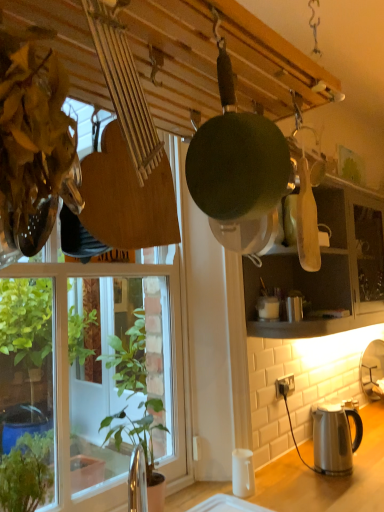
Question: Is green leafy plant at lower left, which appears as the first houseplant when viewed from the left, inside the boundaries of white plastic power outlet at lower right, or outside?

Choices:
 (A) inside
 (B) outside

Answer: (B)

Question: Does point (29, 461) appear closer or farther from the camera than point (291, 376)?

Choices:
 (A) farther
 (B) closer

Answer: (B)

Question: Which object is the closest to the white matte coffee cup at lower right?

Choices:
 (A) green leafy plant at lower left, acting as the first houseplant starting from the front
 (B) matte white cabinet at upper right
 (C) satin silver kettle at lower right
 (D) transparent glass window at upper left
 (E) green matte frying pan at center

Answer: (C)

Question: Considering the real-world distances, which object is farthest from the green leafy plant at lower left, which appears as the 2th houseplant when viewed from the right?

Choices:
 (A) satin silver kettle at lower right
 (B) green leafy plant at left, which ranks as the first houseplant in back-to-front order
 (C) white matte coffee cup at lower right
 (D) white plastic power outlet at lower right
 (E) green matte frying pan at center

Answer: (B)